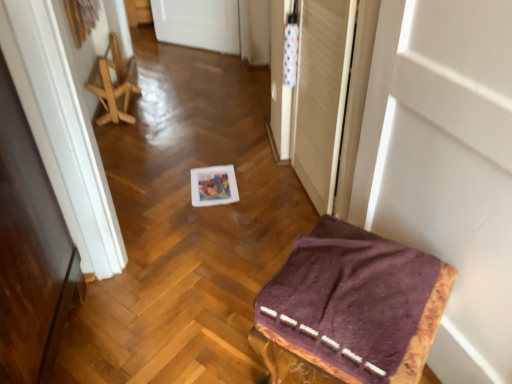
Question: Is the depth of transparent plastic screen door at upper right greater than that of purple fabric-covered stool at lower right, the first furniture positioned from the front?

Choices:
 (A) no
 (B) yes

Answer: (B)

Question: Is transparent plastic screen door at upper right positioned in front of purple fabric-covered stool at lower right, arranged as the first furniture when viewed from the right?

Choices:
 (A) no
 (B) yes

Answer: (A)

Question: Considering the relative sizes of transparent plastic screen door at upper right and purple fabric-covered stool at lower right, which appears as the 1th furniture when ordered from the bottom, in the image provided, is transparent plastic screen door at upper right bigger than purple fabric-covered stool at lower right, which appears as the 1th furniture when ordered from the bottom,?

Choices:
 (A) yes
 (B) no

Answer: (B)

Question: Are transparent plastic screen door at upper right and purple fabric-covered stool at lower right, arranged as the first furniture when viewed from the right, located far from each other?

Choices:
 (A) no
 (B) yes

Answer: (A)

Question: Is transparent plastic screen door at upper right to the right of purple fabric-covered stool at lower right, arranged as the first furniture when viewed from the right, from the viewer's perspective?

Choices:
 (A) no
 (B) yes

Answer: (A)

Question: Is purple fabric-covered stool at lower right, which appears as the 1th furniture when ordered from the bottom, located within transparent plastic screen door at upper right?

Choices:
 (A) yes
 (B) no

Answer: (B)

Question: Is transparent plastic screen door at upper right smaller than white matte door at upper right?

Choices:
 (A) no
 (B) yes

Answer: (B)

Question: Does transparent plastic screen door at upper right contain white matte door at upper right?

Choices:
 (A) yes
 (B) no

Answer: (B)

Question: From a real-world perspective, is transparent plastic screen door at upper right under white matte door at upper right?

Choices:
 (A) yes
 (B) no

Answer: (A)

Question: From the image's perspective, is transparent plastic screen door at upper right beneath white matte door at upper right?

Choices:
 (A) no
 (B) yes

Answer: (A)

Question: Is transparent plastic screen door at upper right oriented towards white matte door at upper right?

Choices:
 (A) no
 (B) yes

Answer: (A)

Question: Is transparent plastic screen door at upper right taller than white matte door at upper right?

Choices:
 (A) no
 (B) yes

Answer: (A)

Question: Is wooden folding chair at left, which ranks as the second furniture in bottom-to-top order, turned away from purple fabric-covered stool at lower right, which appears as the 1th furniture when ordered from the bottom?

Choices:
 (A) no
 (B) yes

Answer: (A)